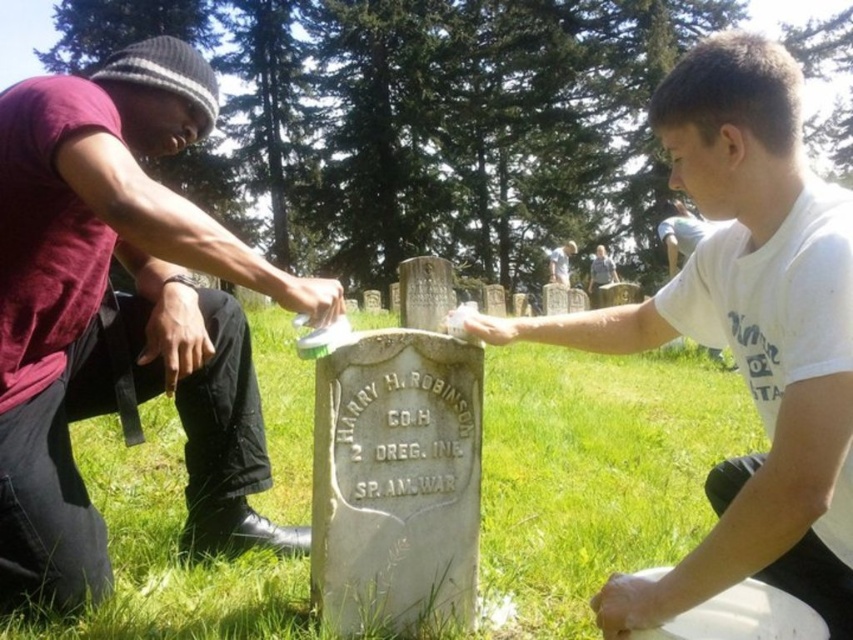
Question: Which of the following is the closest to the observer?

Choices:
 (A) coord(280,289)
 (B) coord(555,262)
 (C) coord(144,356)
 (D) coord(606,632)

Answer: (D)

Question: Which of the following is the farthest from the observer?

Choices:
 (A) white matte stone at center
 (B) maroon cotton shirt at left

Answer: (B)

Question: Considering the relative positions of maroon cotton shirt at left and white matte brush at center in the image provided, where is maroon cotton shirt at left located with respect to white matte brush at center?

Choices:
 (A) left
 (B) right

Answer: (A)

Question: Which object appears closest to the camera in this image?

Choices:
 (A) white matte stone at center
 (B) white matte brush at center

Answer: (A)

Question: Is maroon cotton shirt at left positioned at the back of light gray stone headstone at center?

Choices:
 (A) no
 (B) yes

Answer: (A)

Question: Can you confirm if white matte brush at center is wider than light gray stone headstone at center?

Choices:
 (A) yes
 (B) no

Answer: (B)